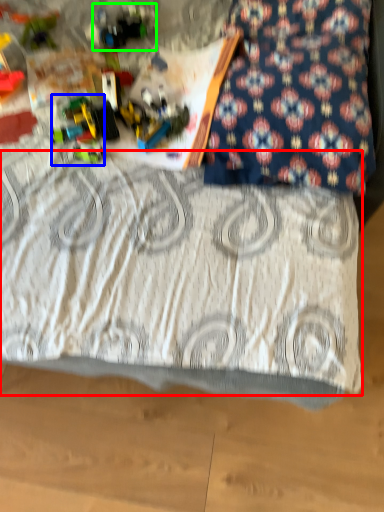
Question: Which object is positioned farthest from bedding (highlighted by a red box)? Select from toy (highlighted by a blue box) and toy (highlighted by a green box).

Choices:
 (A) toy
 (B) toy

Answer: (B)